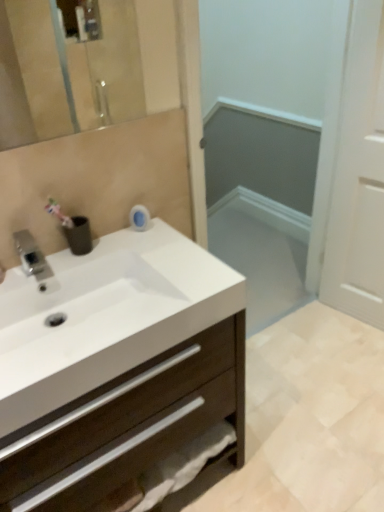
Question: Can you confirm if white glossy screen door at center, which appears as the 2th screen door when viewed from the right, is wider than white matte cabinet at center?

Choices:
 (A) yes
 (B) no

Answer: (B)

Question: Are white glossy screen door at center, the first screen door when ordered from left to right, and white matte cabinet at center beside each other?

Choices:
 (A) no
 (B) yes

Answer: (A)

Question: Is white glossy screen door at center, the first screen door when ordered from left to right, at the left side of white matte cabinet at center?

Choices:
 (A) yes
 (B) no

Answer: (B)

Question: Is white glossy screen door at center, which appears as the 2th screen door when viewed from the right, shorter than white matte cabinet at center?

Choices:
 (A) yes
 (B) no

Answer: (B)

Question: From the image's perspective, is white glossy screen door at center, the first screen door when ordered from left to right, under white matte cabinet at center?

Choices:
 (A) yes
 (B) no

Answer: (B)

Question: Is white glossy screen door at center, the first screen door when ordered from left to right, not within white matte cabinet at center?

Choices:
 (A) yes
 (B) no

Answer: (A)

Question: Does white matte door at right, the first screen door when ordered from right to left, appear on the left side of white glossy screen door at center, which appears as the 2th screen door when viewed from the right?

Choices:
 (A) yes
 (B) no

Answer: (B)

Question: Could you tell me if white matte door at right, which is the 2th screen door in left-to-right order, is facing white glossy screen door at center, the first screen door when ordered from left to right?

Choices:
 (A) no
 (B) yes

Answer: (A)

Question: From the image's perspective, is white matte door at right, which is the 2th screen door in left-to-right order, below white glossy screen door at center, the first screen door when ordered from left to right?

Choices:
 (A) yes
 (B) no

Answer: (B)

Question: Is white matte door at right, which is the 2th screen door in left-to-right order, touching white glossy screen door at center, the first screen door when ordered from left to right?

Choices:
 (A) yes
 (B) no

Answer: (B)

Question: Is white matte door at right, the first screen door when ordered from right to left, not near white glossy screen door at center, which appears as the 2th screen door when viewed from the right?

Choices:
 (A) yes
 (B) no

Answer: (B)

Question: Can you confirm if white matte door at right, which is the 2th screen door in left-to-right order, is wider than white glossy screen door at center, the first screen door when ordered from left to right?

Choices:
 (A) yes
 (B) no

Answer: (B)

Question: Is white matte door at right, which is the 2th screen door in left-to-right order, aimed at silver metallic faucet at upper left?

Choices:
 (A) yes
 (B) no

Answer: (A)